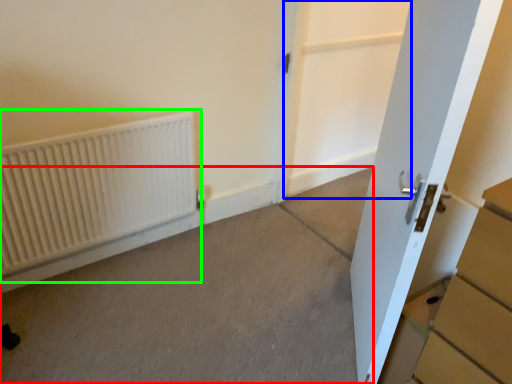
Question: Which object is the closest to the concrete (highlighted by a red box)? Choose among these: screen door (highlighted by a blue box) or radiator (highlighted by a green box).

Choices:
 (A) screen door
 (B) radiator

Answer: (B)